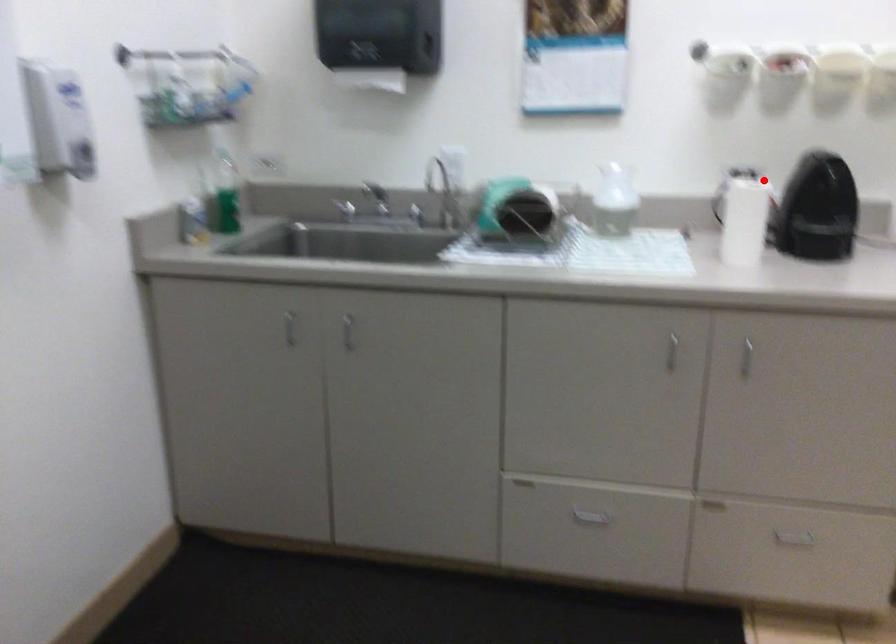
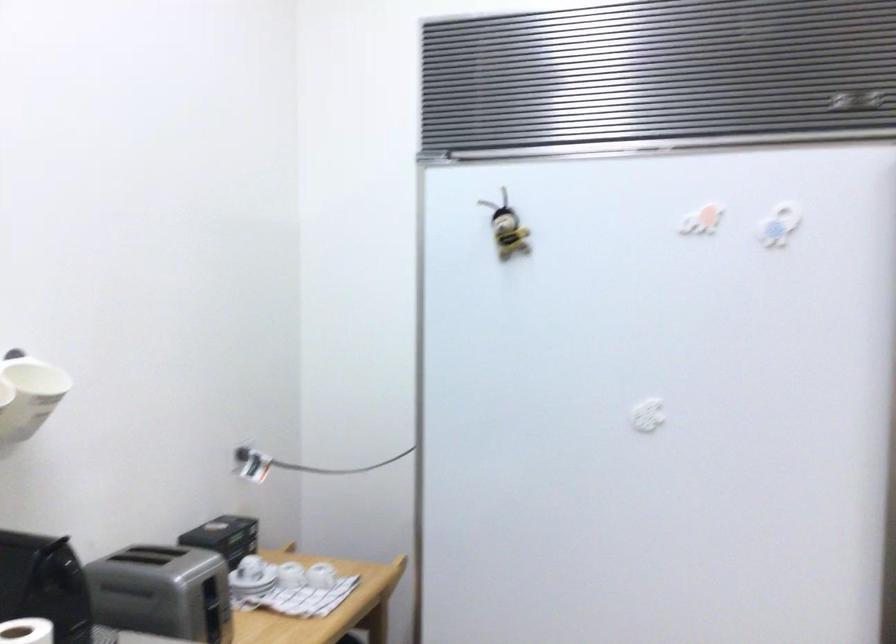
Question: I am providing you with two images of the same scene from different viewpoints. Image1 has a red point marked. In image2, the corresponding 3D location appears at what relative position? Reply with the corresponding letter.

Choices:
 (A) Closer
 (B) Farther

Answer: (A)